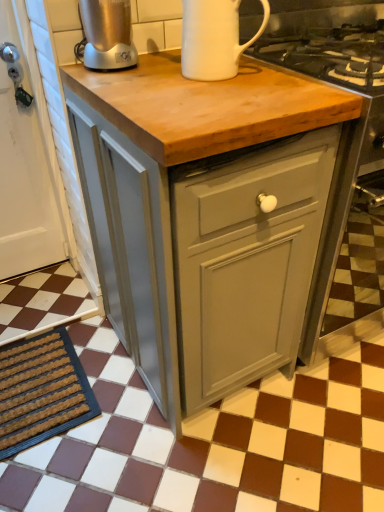
Locate an element on the screen. The image size is (384, 512). free spot in front of brushed metal blender at upper left, which is the 1th kitchen appliance from left to right is located at coordinates (125, 78).